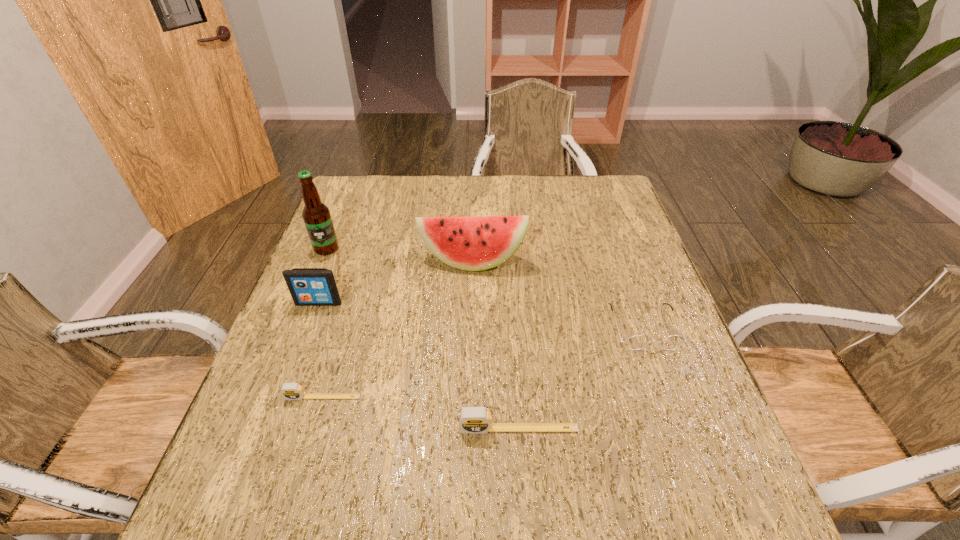
You are a GUI agent. You are given a task and a screenshot of the screen. Output one action in this format:
    pyautogui.click(x=<x>, y=<y>)
    Task: Click on the second nearest object
    
    Given the screenshot: What is the action you would take?
    pyautogui.click(x=291, y=391)

The height and width of the screenshot is (540, 960). In order to click on the farther tape measure in this screenshot , I will do `click(291, 391)`.

Where is `the taller tape measure`? the taller tape measure is located at coordinates (474, 420).

Identify the location of the nearer tape measure. (474, 420).

The height and width of the screenshot is (540, 960). I want to click on beer bottle, so click(316, 215).

Where is `the second tallest object`? The width and height of the screenshot is (960, 540). the second tallest object is located at coordinates (474, 243).

Locate an element on the screen. iPod is located at coordinates (308, 286).

Identify the location of spectacles. (636, 342).

What are the coordinates of `the second shortest object` in the screenshot? It's located at pos(636,342).

You are a GUI agent. You are given a task and a screenshot of the screen. Output one action in this format:
    pyautogui.click(x=<x>, y=<y>)
    Task: Click on the vacant space located on the label of the beer bottle
    The width and height of the screenshot is (960, 540).
    Given the screenshot: What is the action you would take?
    pyautogui.click(x=308, y=295)